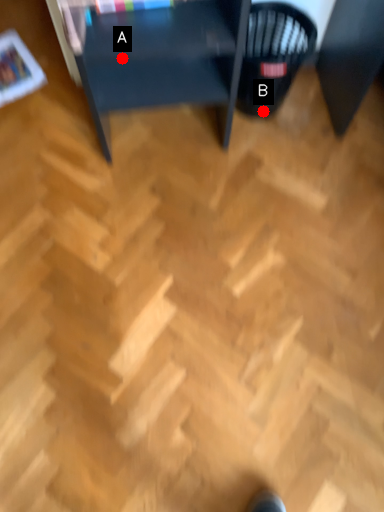
Question: Two points are circled on the image, labeled by A and B beside each circle. Among these points, which one is nearest to the camera?

Choices:
 (A) A is closer
 (B) B is closer

Answer: (A)